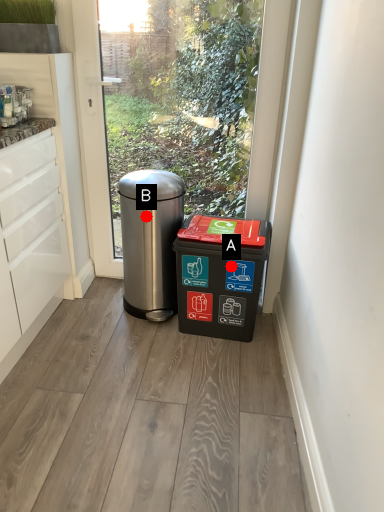
Question: Two points are circled on the image, labeled by A and B beside each circle. Which of the following is the farthest from the observer?

Choices:
 (A) A is further
 (B) B is further

Answer: (B)